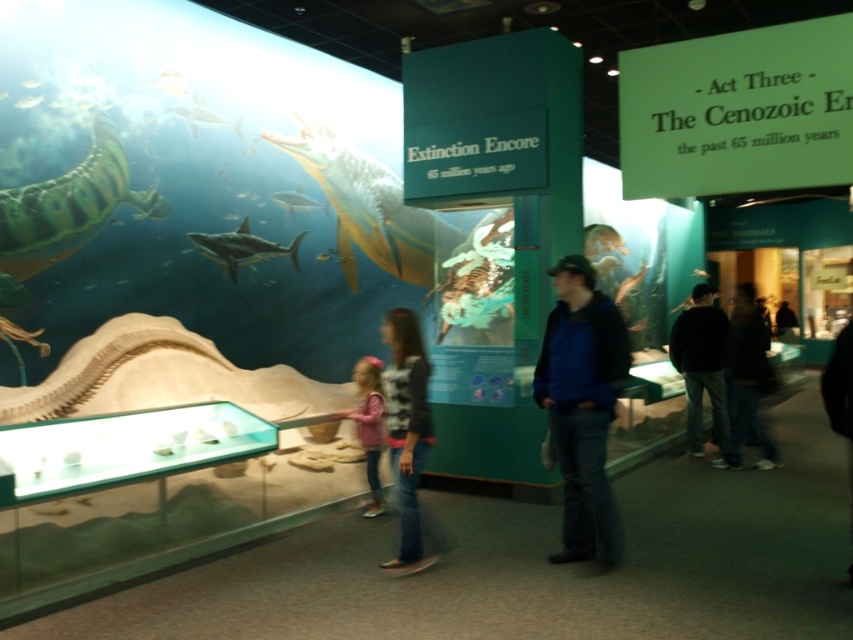
Question: Where is green matte fish at upper left located in relation to shiny silver shark at upper center in the image?

Choices:
 (A) below
 (B) above

Answer: (A)

Question: Can you confirm if denim jeans at center is positioned to the right of shiny silver fish at upper left?

Choices:
 (A) no
 (B) yes

Answer: (B)

Question: Which object appears closest to the camera in this image?

Choices:
 (A) denim jeans at center
 (B) shiny silver shark at upper center

Answer: (A)

Question: Which of the following is the farthest from the observer?

Choices:
 (A) shiny metallic fish at upper center
 (B) dark blue jeans at lower right
 (C) blue denim jacket at center

Answer: (A)

Question: Can you confirm if translucent white shark at upper center is positioned below shiny silver shark at upper center?

Choices:
 (A) yes
 (B) no

Answer: (B)

Question: Among these points, which one is farthest from the camera?

Choices:
 (A) (370, 515)
 (B) (253, 244)
 (C) (747, 348)
 (D) (692, 323)

Answer: (D)